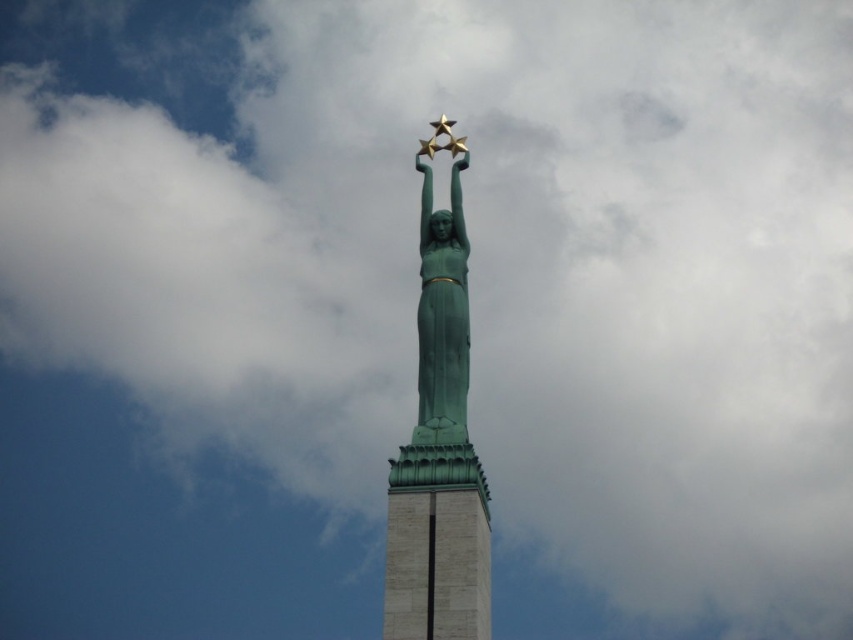
Question: Which point appears closest to the camera in this image?

Choices:
 (A) (444, 509)
 (B) (397, 548)

Answer: (B)

Question: Can you confirm if green patina statue at center is wider than green stone tower at center?

Choices:
 (A) yes
 (B) no

Answer: (A)

Question: Is green patina statue at center wider than green stone tower at center?

Choices:
 (A) no
 (B) yes

Answer: (B)

Question: Which point is farther to the camera?

Choices:
 (A) (469, 502)
 (B) (438, 600)

Answer: (A)

Question: Which point is closer to the camera?

Choices:
 (A) (445, 451)
 (B) (474, 484)

Answer: (B)

Question: Can you confirm if green patina statue at center is positioned to the right of green stone tower at center?

Choices:
 (A) no
 (B) yes

Answer: (A)